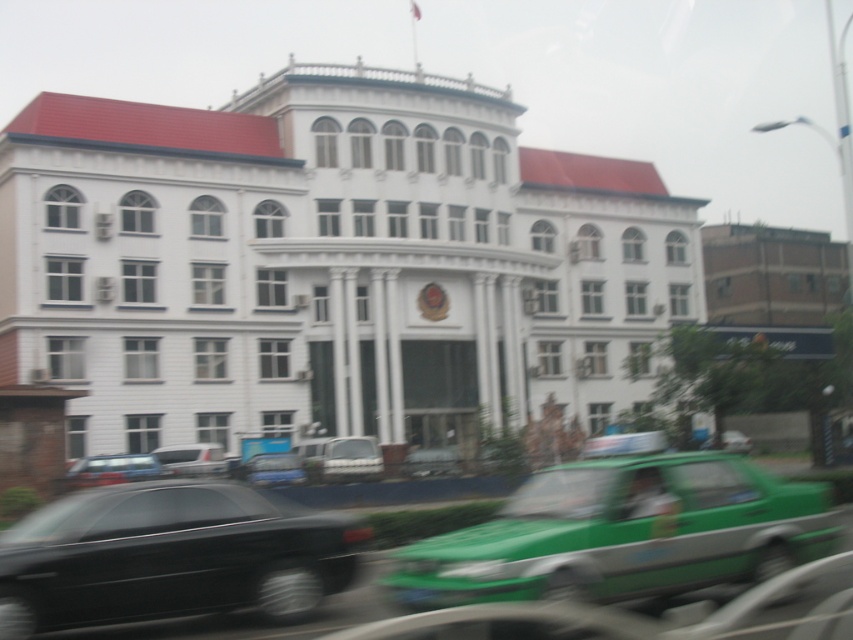
You are a delivery driver approaching the building and need to park your white matte van at center without blocking the clear glass window at upper left. Based on the scene, can you park the van in such a way that it doesn

The white matte van at center is currently in front of the clear glass window at upper left, so if you park it there, it will block the window. Choose another parking spot to avoid obstruction.

You are a photographer who just took a picture of a government building. In your photo, there are two objects of interest. One is the shiny black sedan at lower left and the other is the clear glass window at upper left. Which object in your photo appears bigger?

The shiny black sedan at lower left appears bigger in the photo than the clear glass window at upper left because it is larger in size.

You are a pedestrian standing on the sidewalk in front of the building. You see a white matte van at center and a green matte car at center. Which vehicle is positioned higher relative to the ground?

The white matte van at center is positioned higher relative to the ground than the green matte car at center.